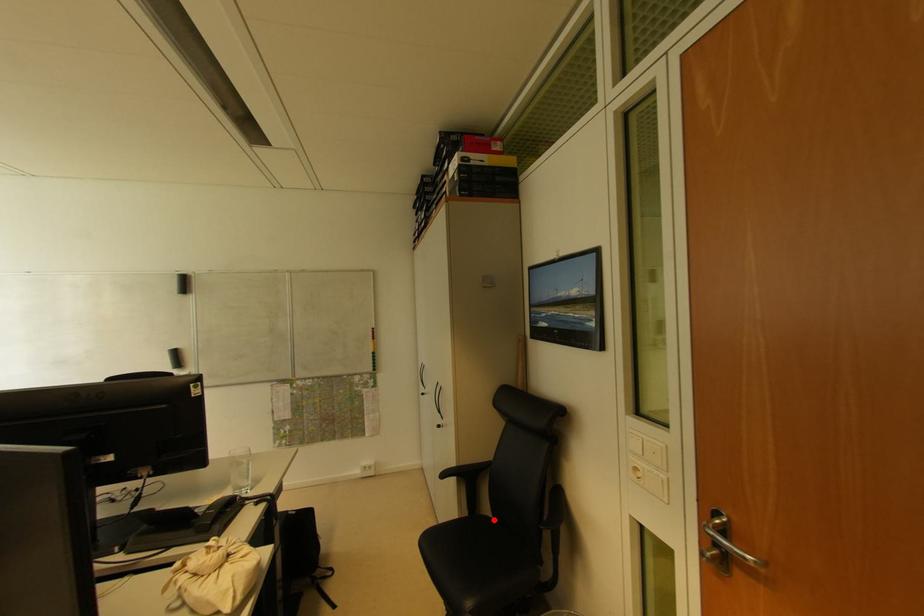
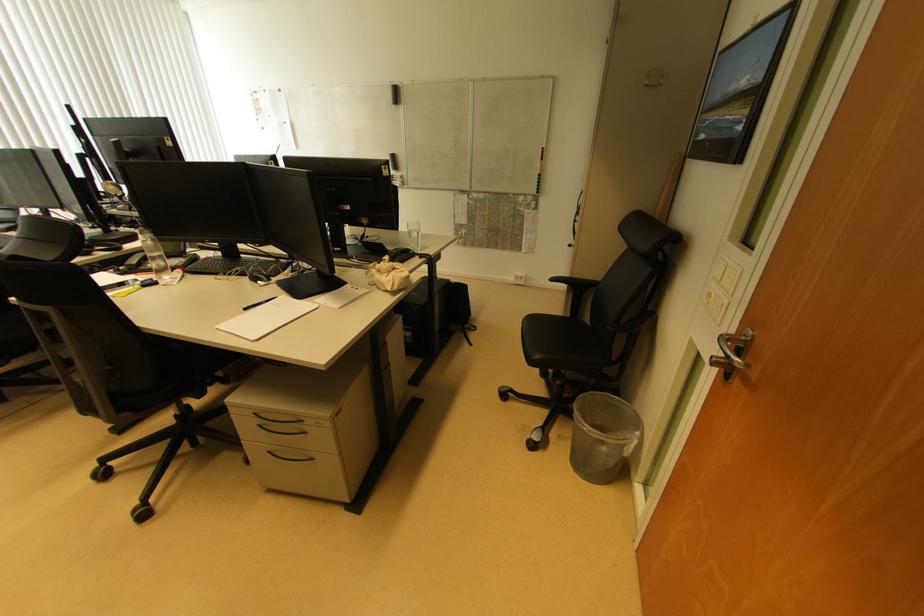
Question: I am providing you with two images of the same scene from different viewpoints. A red point is marked on the first image. Can you still see the location of the red point in image 2?

Choices:
 (A) Yes
 (B) No

Answer: (A)